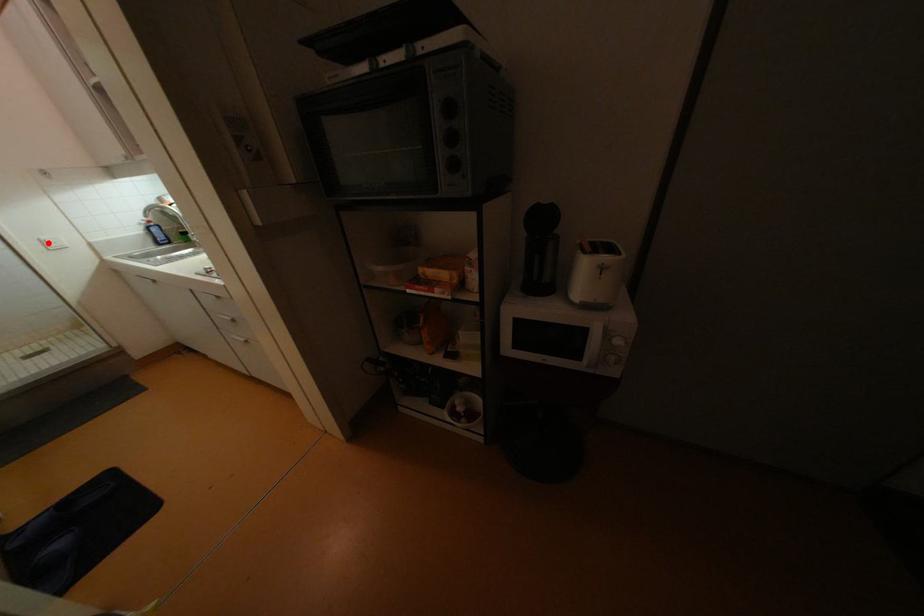
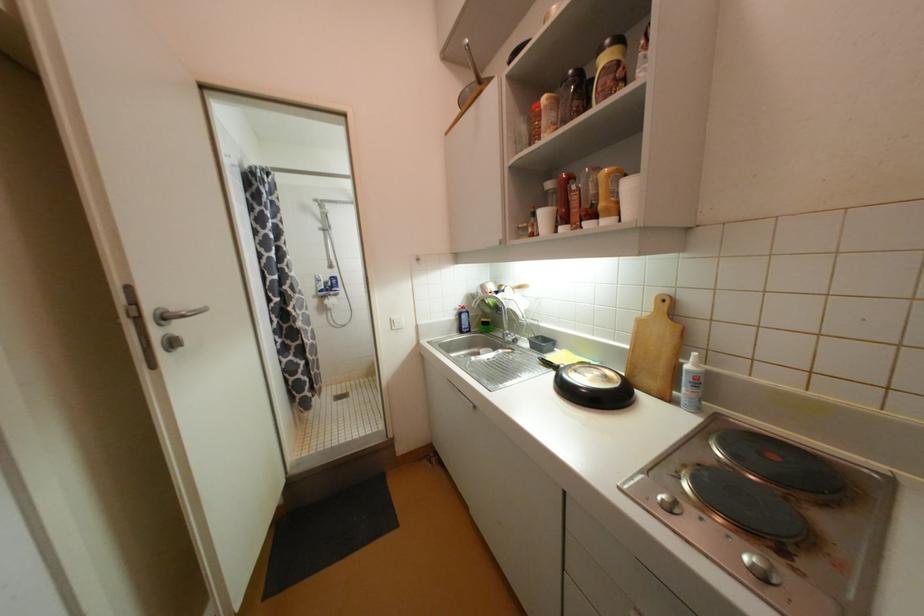
Question: I am providing you with two images of the same scene from different viewpoints. Given a red point in image1, look at the same physical point in image2. Is it:

Choices:
 (A) Closer to the viewpoint
 (B) Farther from the viewpoint

Answer: (A)